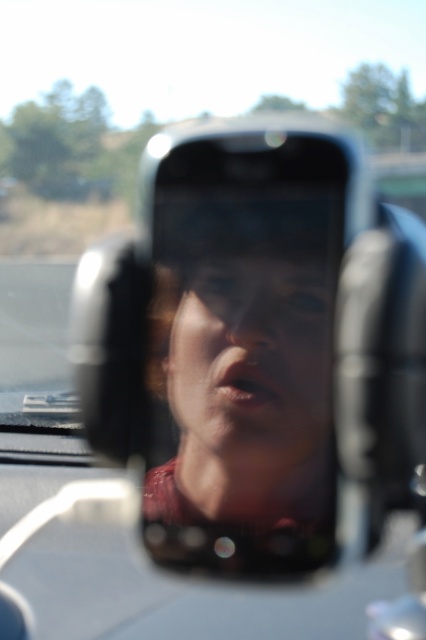
You are a passenger in the car and want to check the phone screen mounted on the dashboard. The phone is held by the matte black phone at center and your face is reflected in the smooth skin face at center. Can you tell which object is taller?

The matte black phone at center is taller than the smooth skin face at center.

You are a passenger in a car and want to check your phone screen. You notice the matte black phone at center and the smooth skin face at center in the reflection. Which object is larger in the image?

The matte black phone at center is bigger than smooth skin face at center, so the matte black phone at center is larger in the image.